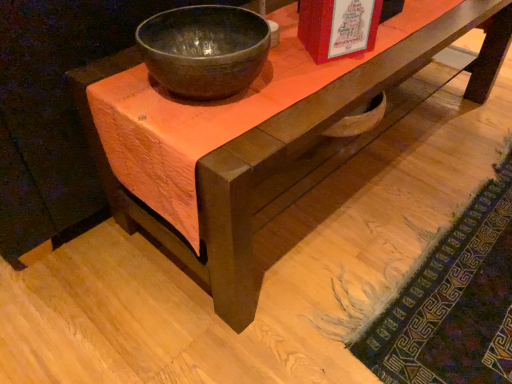
The image size is (512, 384). In order to click on free spot below textured wool mat at lower right (from a real-world perspective) in this screenshot , I will do `click(441, 271)`.